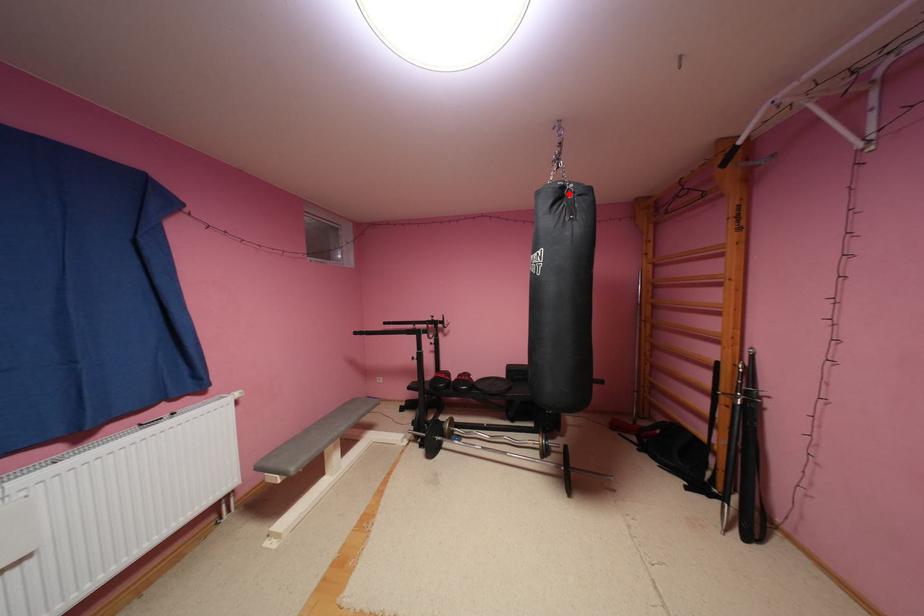
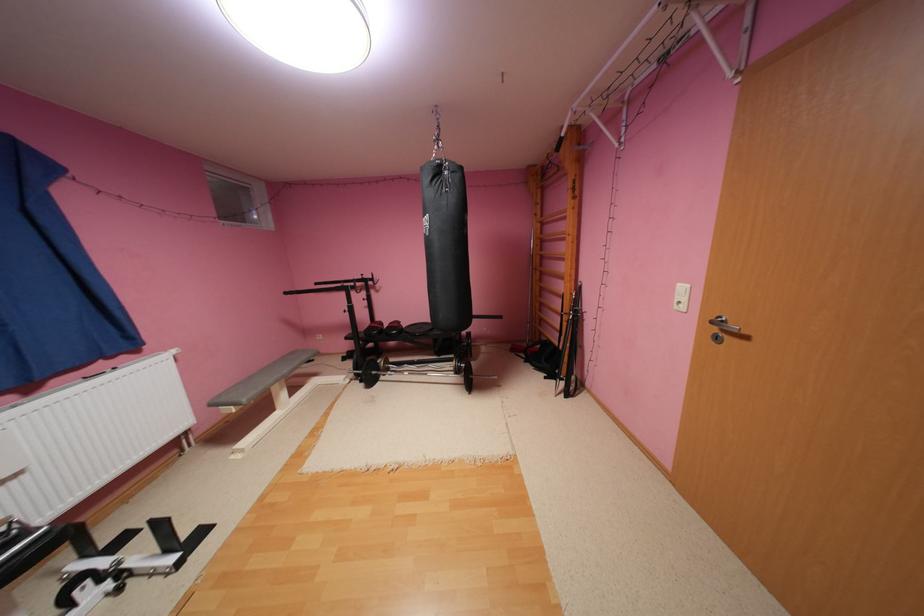
Where in the second image is the point corresponding to the highlighted location from the first image?

(446, 171)